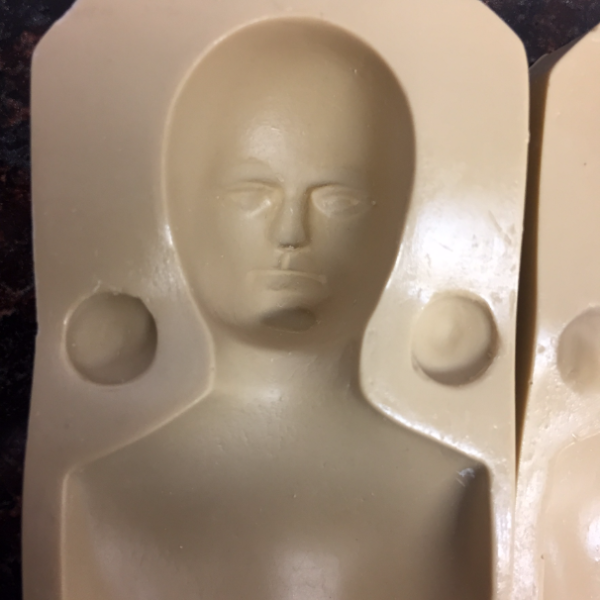
Where is `table`? The height and width of the screenshot is (600, 600). table is located at coordinates (545, 13).